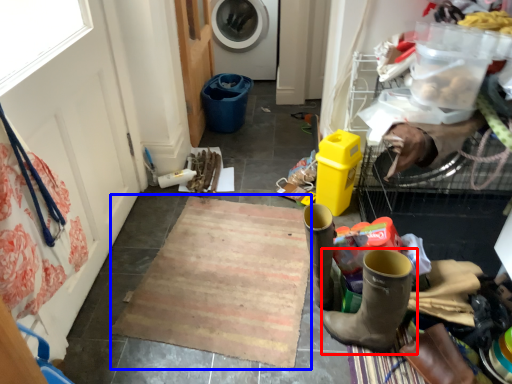
Question: Which of the following is the farthest to the observer, footwear (highlighted by a red box) or doormat (highlighted by a blue box)?

Choices:
 (A) footwear
 (B) doormat

Answer: (B)